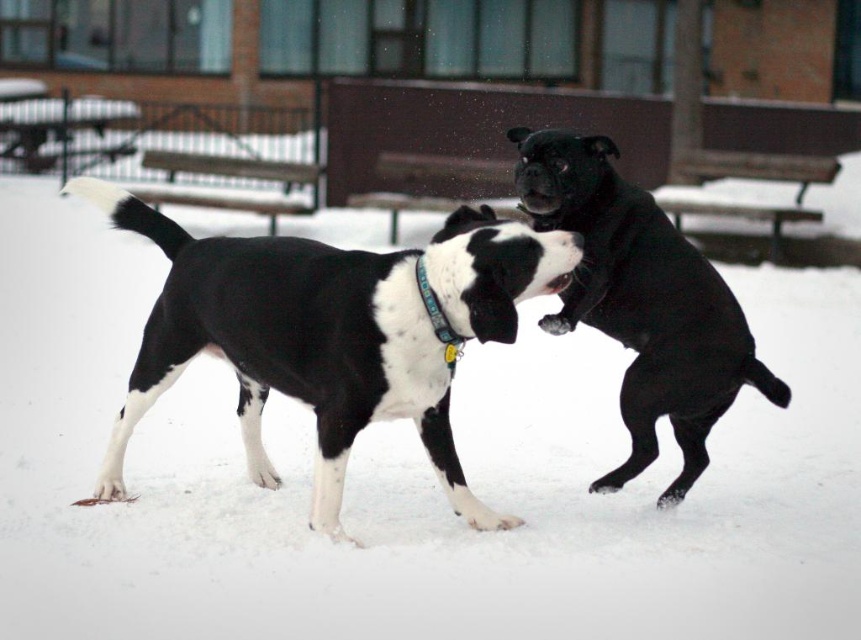
Based on the photo, who is shorter, black and white fur dog at center or teal fabric neckband at center?

teal fabric neckband at center

Who is more forward, (321,476) or (454,332)?

Point (454,332) is in front.

This screenshot has height=640, width=861. I want to click on black and white fur dog at center, so click(x=330, y=332).

From the picture: Does black and white fur dog at center have a larger size compared to black glossy dog at center?

Indeed, black and white fur dog at center has a larger size compared to black glossy dog at center.

Between black and white fur dog at center and black glossy dog at center, which one has more height?

Standing taller between the two is black glossy dog at center.

Locate an element on the screen. Image resolution: width=861 pixels, height=640 pixels. black and white fur dog at center is located at coordinates (330, 332).

Locate an element on the screen. The image size is (861, 640). black and white fur dog at center is located at coordinates (330, 332).

Which is in front, point (604, 328) or point (418, 268)?

Positioned in front is point (418, 268).

Between black glossy dog at center and teal fabric neckband at center, which one appears on the left side from the viewer's perspective?

From the viewer's perspective, teal fabric neckband at center appears more on the left side.

Image resolution: width=861 pixels, height=640 pixels. I want to click on black glossy dog at center, so click(x=641, y=300).